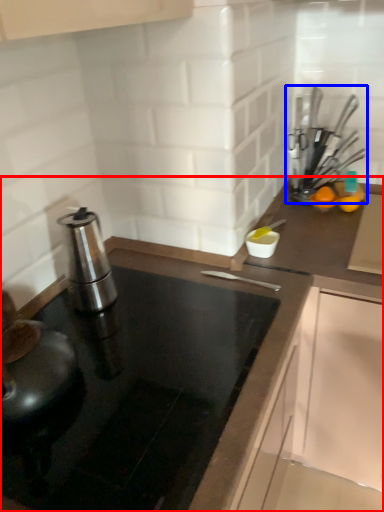
Question: Among these objects, which one is farthest to the camera, countertop (highlighted by a red box) or kitchen appliance (highlighted by a blue box)?

Choices:
 (A) countertop
 (B) kitchen appliance

Answer: (B)